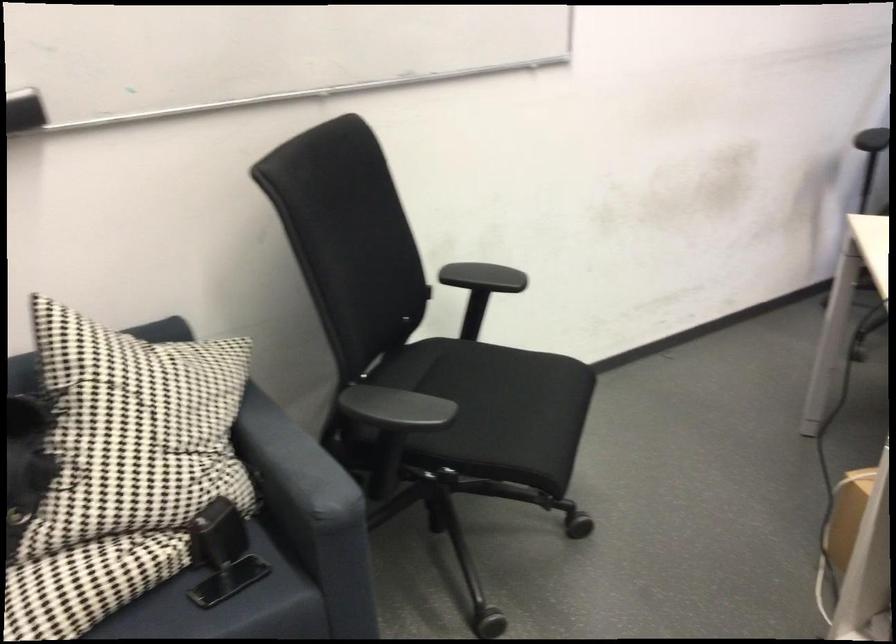
Which object does [228,581] point to?

It corresponds to the black smartphone in the image.